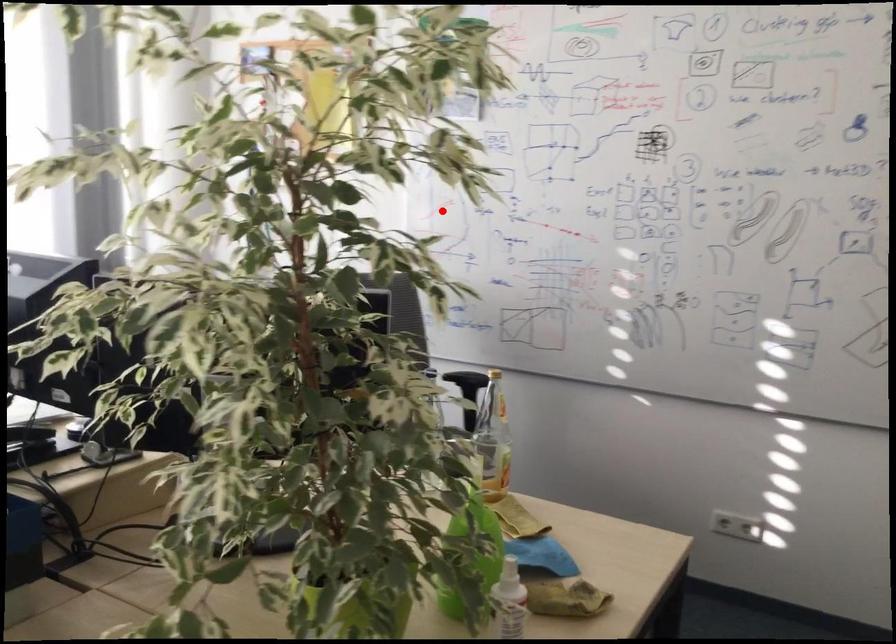
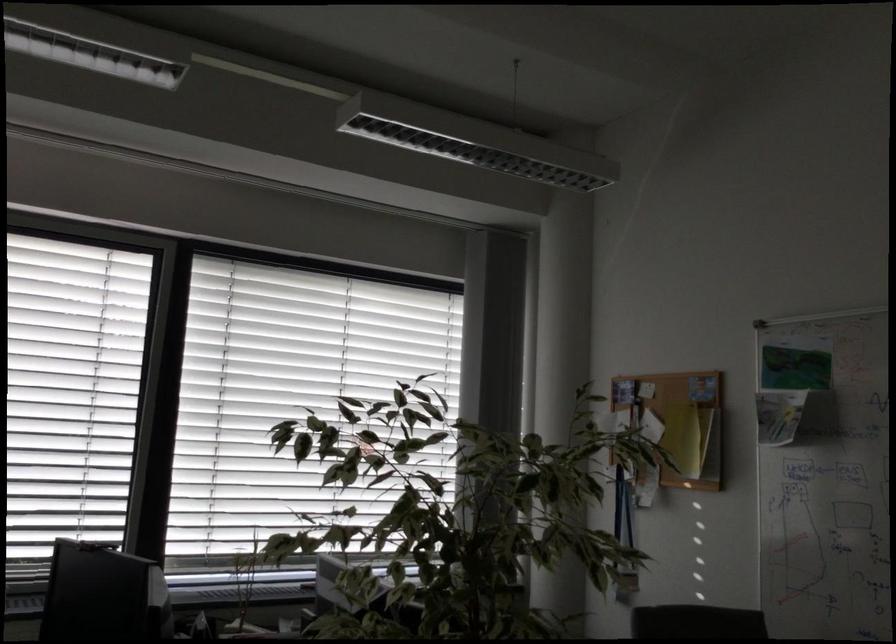
Find the pixel in the second image that matches the highlighted location in the first image.

(786, 538)